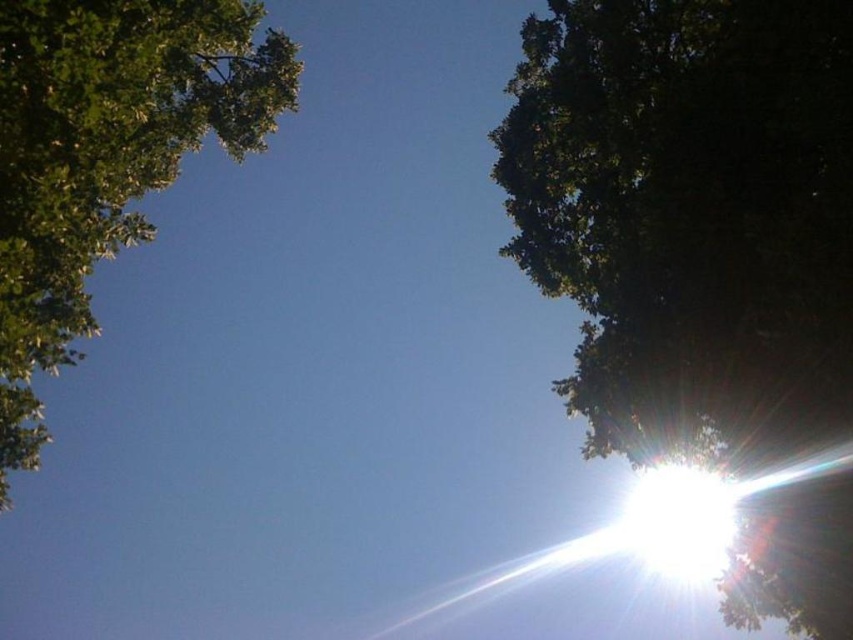
Question: Does green leafy tree at upper right have a greater width compared to green leafy tree at upper left?

Choices:
 (A) yes
 (B) no

Answer: (A)

Question: Among these points, which one is farthest from the camera?

Choices:
 (A) (128, 176)
 (B) (769, 419)

Answer: (A)

Question: Is the position of green leafy tree at upper right less distant than that of green leafy tree at upper left?

Choices:
 (A) no
 (B) yes

Answer: (A)

Question: Is green leafy tree at upper right thinner than green leafy tree at upper left?

Choices:
 (A) yes
 (B) no

Answer: (B)

Question: Which point is closer to the camera taking this photo?

Choices:
 (A) (689, 348)
 (B) (248, 120)

Answer: (A)